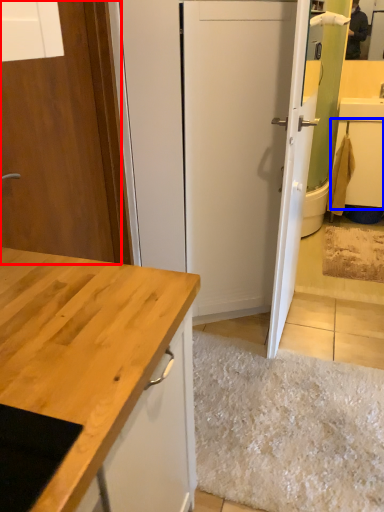
Question: Which object is closer to the camera taking this photo, door (highlighted by a red box) or cabinetry (highlighted by a blue box)?

Choices:
 (A) door
 (B) cabinetry

Answer: (A)